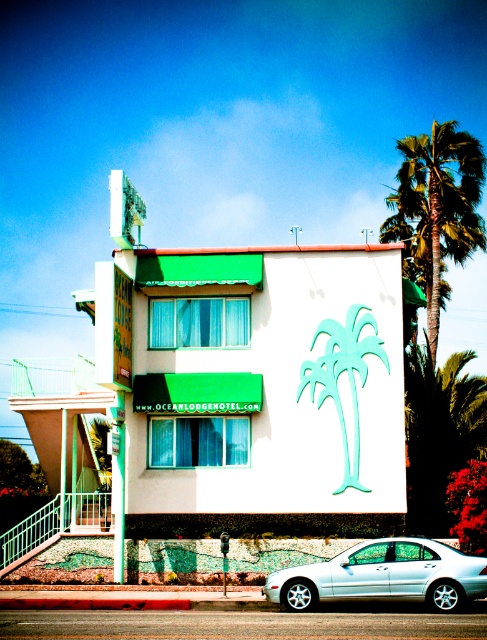
You are a visitor to the Ocean Lodge Hotel and want to park your car. The parking meter in front of the hotel is located between the green leafy palm tree at upper right and the white metallic car at lower center. Can you estimate whether the parking meter is closer to the palm tree or the car?

The green leafy palm tree at upper right is taller than the white metallic car at lower center. However, the question is about the distance between the parking meter and the two objects. Since the description only provides information about their heights, we cannot determine which is closer based on height alone. More information about their positions or distances would be needed to answer this accurately.

You are standing in front of the Ocean Lodge Hotel and need to determine the relative depth of two points marked on the building. Which point, point 1 at coordinates (439, 250) or point 2 at coordinates (393, 554), is closer to you?

Point 1 at coordinates (439, 250) is closer to you because it is further to the viewer than point 2 at coordinates (393, 554).